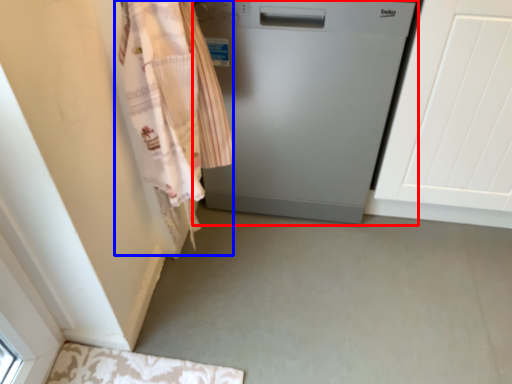
Question: Which object is closer to the camera taking this photo, home appliance (highlighted by a red box) or clothing (highlighted by a blue box)?

Choices:
 (A) home appliance
 (B) clothing

Answer: (B)